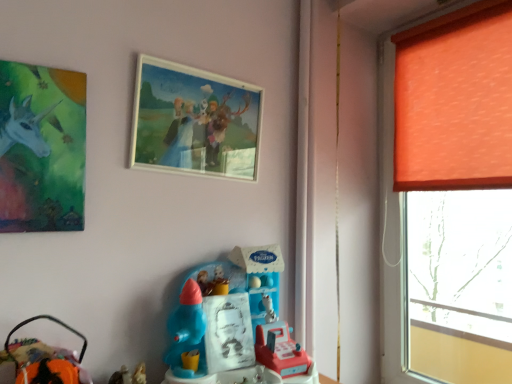
Question: Is matte green painting at upper left, the first picture frame viewed from the left, not within velvet orange plush at lower left, positioned as the 2th toy in right-to-left order?

Choices:
 (A) yes
 (B) no

Answer: (A)

Question: Can you confirm if matte green painting at upper left, arranged as the 2th picture frame when viewed from the back, is smaller than velvet orange plush at lower left, which appears as the 1th toy when viewed from the left?

Choices:
 (A) yes
 (B) no

Answer: (B)

Question: Considering the relative sizes of matte green painting at upper left, arranged as the 2th picture frame when viewed from the back, and velvet orange plush at lower left, positioned as the 2th toy in right-to-left order, in the image provided, is matte green painting at upper left, arranged as the 2th picture frame when viewed from the back, shorter than velvet orange plush at lower left, positioned as the 2th toy in right-to-left order,?

Choices:
 (A) no
 (B) yes

Answer: (A)

Question: From the image's perspective, is matte green painting at upper left, placed as the 1th picture frame when sorted from front to back, below velvet orange plush at lower left, positioned as the 2th toy in right-to-left order?

Choices:
 (A) no
 (B) yes

Answer: (A)

Question: From a real-world perspective, is matte green painting at upper left, the first picture frame viewed from the left, beneath velvet orange plush at lower left, which appears as the 1th toy when viewed from the left?

Choices:
 (A) yes
 (B) no

Answer: (B)

Question: Is matte green painting at upper left, placed as the 1th picture frame when sorted from front to back, directly adjacent to velvet orange plush at lower left, which appears as the 1th toy when viewed from the left?

Choices:
 (A) no
 (B) yes

Answer: (A)

Question: Considering the relative positions of plastic toy at center, placed as the second toy when sorted from left to right, and velvet orange plush at lower left, positioned as the 2th toy in right-to-left order, in the image provided, is plastic toy at center, placed as the second toy when sorted from left to right, to the right of velvet orange plush at lower left, positioned as the 2th toy in right-to-left order, from the viewer's perspective?

Choices:
 (A) yes
 (B) no

Answer: (A)

Question: Is velvet orange plush at lower left, positioned as the 2th toy in right-to-left order, at the back of plastic toy at center, placed as the second toy when sorted from left to right?

Choices:
 (A) yes
 (B) no

Answer: (B)

Question: Does plastic toy at center, marked as the 1th toy in a right-to-left arrangement, have a greater width compared to velvet orange plush at lower left, which appears as the 1th toy when viewed from the left?

Choices:
 (A) yes
 (B) no

Answer: (A)

Question: Is plastic toy at center, marked as the 1th toy in a right-to-left arrangement, further to camera compared to velvet orange plush at lower left, which appears as the 1th toy when viewed from the left?

Choices:
 (A) yes
 (B) no

Answer: (A)

Question: Does plastic toy at center, placed as the second toy when sorted from left to right, turn towards velvet orange plush at lower left, positioned as the 2th toy in right-to-left order?

Choices:
 (A) no
 (B) yes

Answer: (A)

Question: From the image's perspective, is plastic toy at center, marked as the 1th toy in a right-to-left arrangement, located above velvet orange plush at lower left, positioned as the 2th toy in right-to-left order?

Choices:
 (A) no
 (B) yes

Answer: (B)

Question: Is velvet orange plush at lower left, positioned as the 2th toy in right-to-left order, located within orange fabric curtain at right?

Choices:
 (A) yes
 (B) no

Answer: (B)